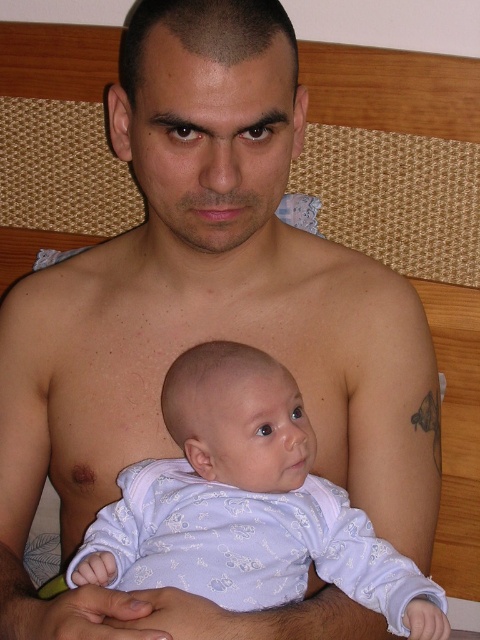
You are a photographer setting up for a portrait session. You need to position a light source between the wooden headboard at upper center and the light purple fabric baby at center to ensure even lighting. Given the distance between them, what is the minimum length of the light stand pole required to place the light exactly halfway between the two?

The wooden headboard at upper center is 28.19 inches away from the light purple fabric baby at center. To place the light exactly halfway, the pole needs to reach at least 14.095 inches from either object, so the minimum length required is approximately 14.1 inches.

You are a photographer adjusting the camera position to capture both the wooden headboard at upper center and the baby in the scene. The minimum distance you need to maintain between the camera and the subjects is 3 feet. Can you position the camera close enough while still including both subjects in the frame?

The distance between the wooden headboard at upper center and the baby is 3.74 feet. Since the required minimum distance is 3 feet, you can position the camera close enough as 3.74 feet is greater than 3 feet, allowing both subjects to be in the frame.

Based on the photo, you are a photographer setting up for a family portrait. You need to position a light source so that it illuminates both the wooden headboard at upper center and the light purple fabric baby at center without causing harsh shadows. Considering their heights, where should you place the light source?

The wooden headboard at upper center is taller than the light purple fabric baby at center. To avoid harsh shadows, the light source should be placed above and slightly behind the wooden headboard at upper center, ensuring it reaches both objects evenly.